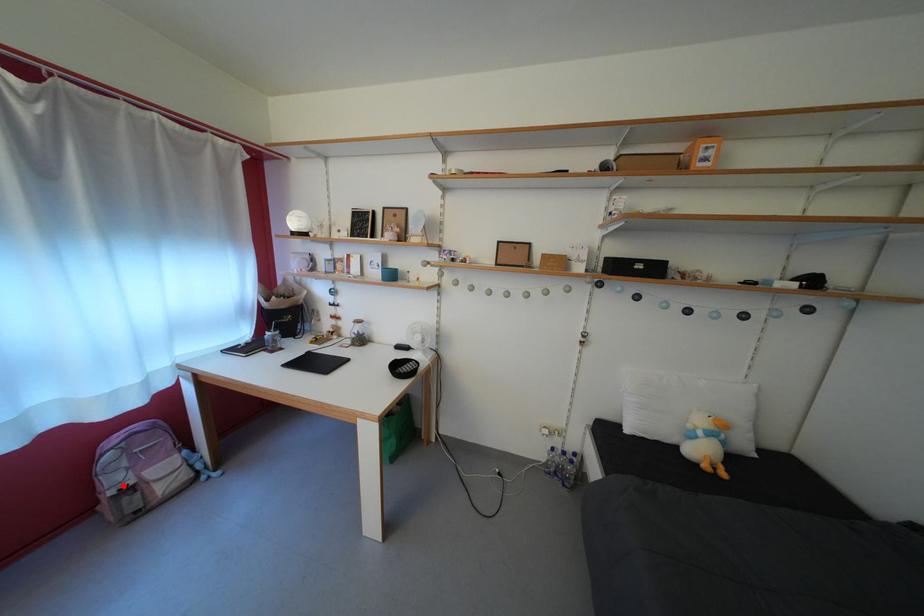
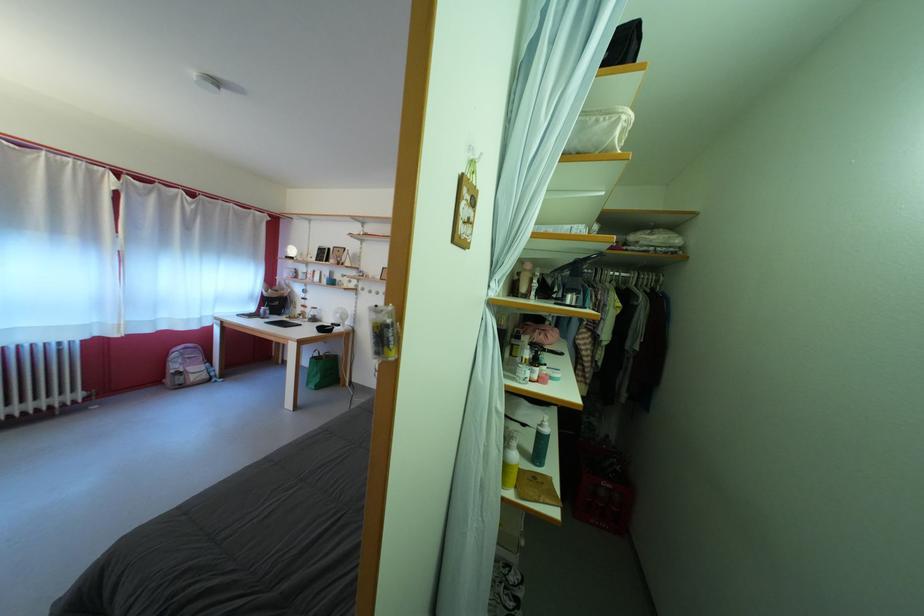
Locate, in the second image, the point that corresponds to the highlighted location in the first image.

(184, 373)